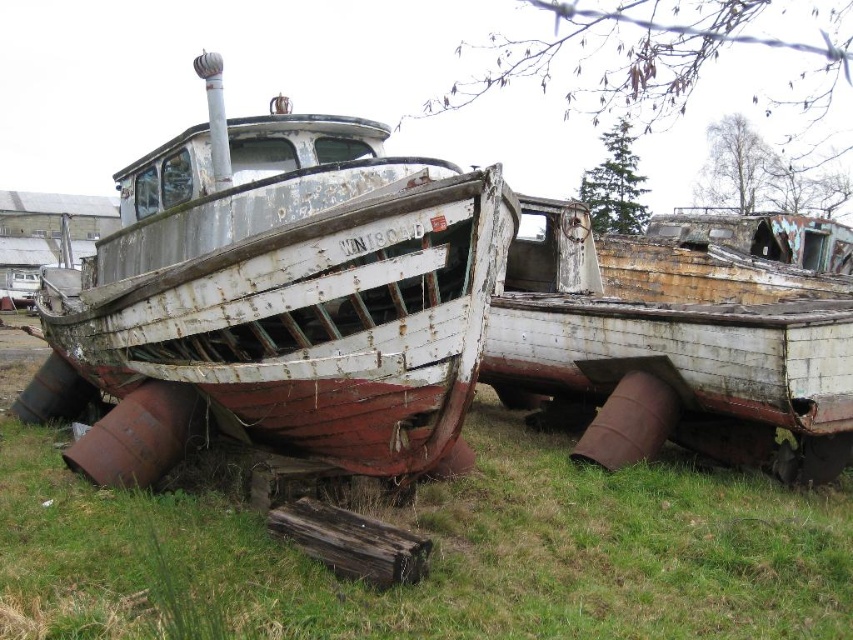
Which is in front, point (131, 413) or point (714, 300)?

Point (131, 413) is more forward.

Is point (91, 438) farther from camera compared to point (585, 237)?

No, (91, 438) is in front of (585, 237).

Is point (428, 344) farther from viewer compared to point (608, 388)?

No, it is in front of (608, 388).

You are a GUI agent. You are given a task and a screenshot of the screen. Output one action in this format:
    pyautogui.click(x=<x>, y=<y>)
    Task: Click on the rusty wood boat at center
    
    Given the screenshot: What is the action you would take?
    pyautogui.click(x=287, y=296)